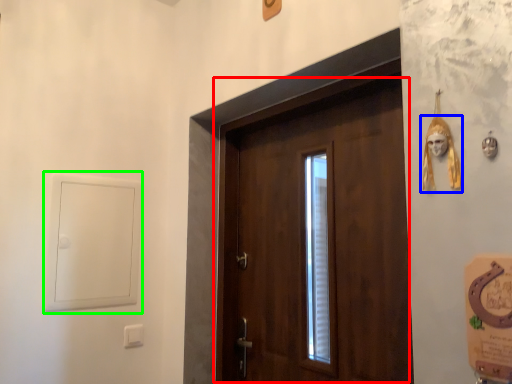
Question: Based on their relative distances, which object is nearer to door (highlighted by a red box)? Choose from skull (highlighted by a blue box) and window (highlighted by a green box).

Choices:
 (A) skull
 (B) window

Answer: (B)